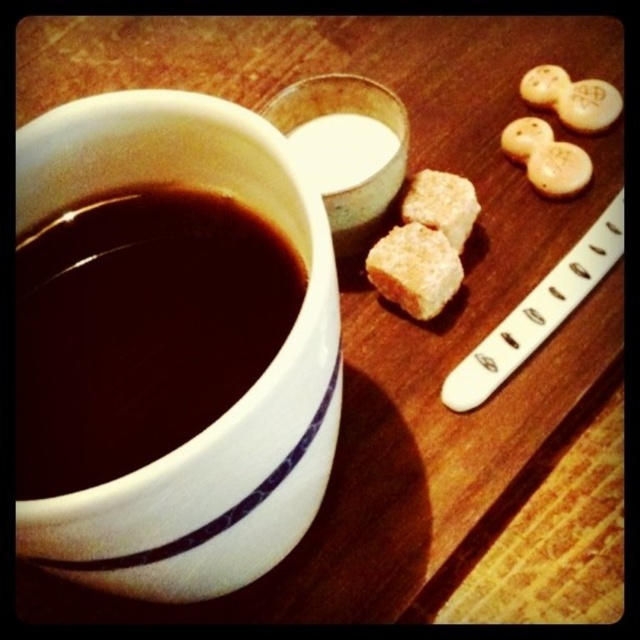
Question: From the image, what is the correct spatial relationship of white matte milk at center in relation to white textured cookie at upper right?

Choices:
 (A) below
 (B) above

Answer: (A)

Question: Is brown sugar cubes at center further to camera compared to white matte cookie at upper right?

Choices:
 (A) no
 (B) yes

Answer: (A)

Question: Which point is farther from the camera taking this photo?

Choices:
 (A) (284, 282)
 (B) (525, 99)
 (C) (580, 93)
 (D) (568, 180)

Answer: (B)

Question: Which object is the closest to the dark glossy mug at upper left?

Choices:
 (A) brown sugar cubes at center
 (B) matte white cookie at upper right

Answer: (A)

Question: From the image, what is the correct spatial relationship of brown sugar cube at center in relation to white textured cookie at upper right?

Choices:
 (A) above
 (B) below

Answer: (B)

Question: Which object is farther from the camera taking this photo?

Choices:
 (A) dark glossy mug at upper left
 (B) matte white cookie at upper right
 (C) brown sugar cube at center
 (D) white textured cookie at upper right

Answer: (B)